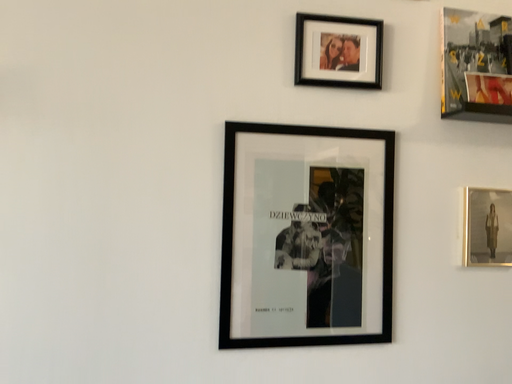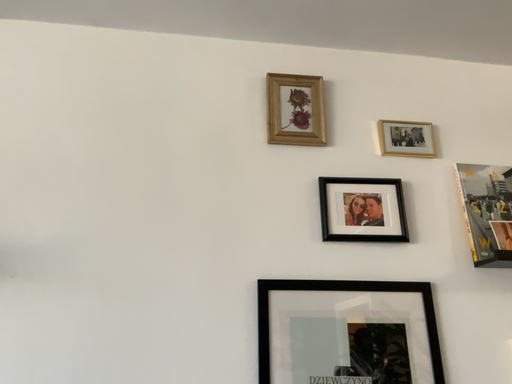
Question: Which way did the camera rotate in the video?

Choices:
 (A) rotated downward
 (B) rotated upward

Answer: (B)